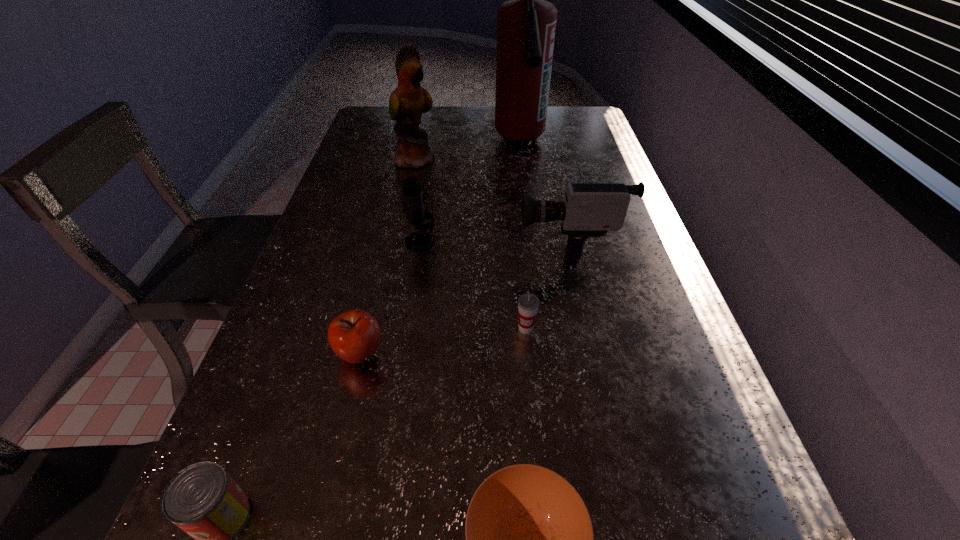
At what (x,y) coordinates should I click in order to perform the action: click on vacant region located on the recording direction of the camcorder. Please return your answer as a coordinate pair (x, y). The width and height of the screenshot is (960, 540). Looking at the image, I should click on (395, 242).

Where is `vacant region located 0.260m on the back of the microphone`? The image size is (960, 540). vacant region located 0.260m on the back of the microphone is located at coordinates (430, 179).

I want to click on vacant space located 0.090m on the right of the apple, so click(x=431, y=354).

This screenshot has width=960, height=540. In order to click on vacant area situated on the side of the cup with the logo in this screenshot , I will do `click(537, 447)`.

Locate an element on the screen. object located in the far edge section of the desktop is located at coordinates (526, 25).

The image size is (960, 540). I want to click on parrot that is positioned at the left edge, so click(x=409, y=100).

Identify the location of apple situated at the left edge. Image resolution: width=960 pixels, height=540 pixels. (354, 336).

This screenshot has height=540, width=960. Identify the location of object present at the right edge. (589, 210).

In the image, there is a desktop. Where is `free space at the left edge`? free space at the left edge is located at coordinates pos(392,148).

You are a GUI agent. You are given a task and a screenshot of the screen. Output one action in this format:
    pyautogui.click(x=<x>, y=<y>)
    Task: Click on the vacant space at the right edge
    The width and height of the screenshot is (960, 540).
    Given the screenshot: What is the action you would take?
    pyautogui.click(x=690, y=380)